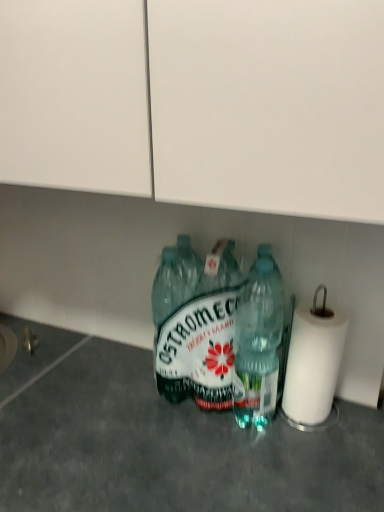
This screenshot has height=512, width=384. I want to click on free location in front of translucent plastic bottle at center, acting as the 2th bottle starting from the left, so click(266, 469).